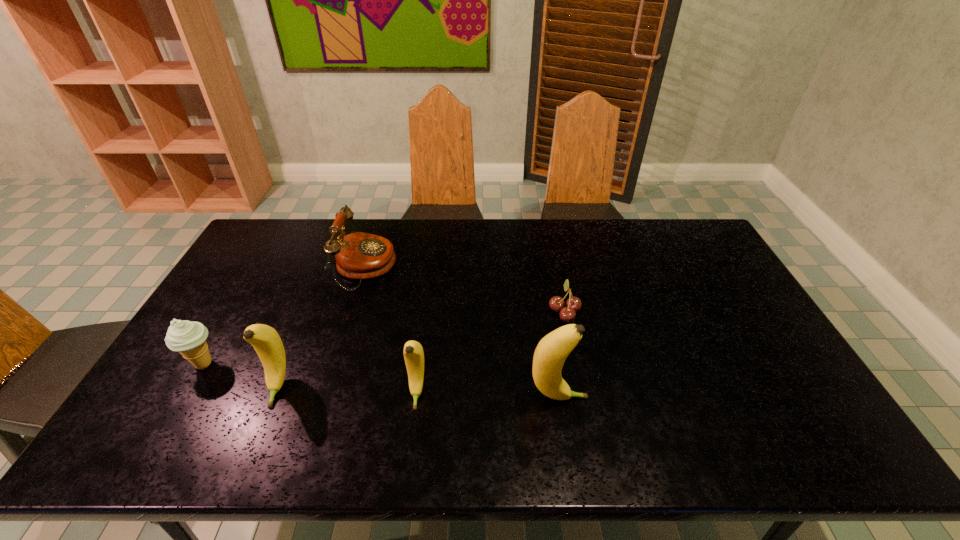
Image resolution: width=960 pixels, height=540 pixels. I want to click on free space located from the stem of the rightmost banana, so click(676, 398).

Where is `free space located on the dial of the third object from left to right`? Image resolution: width=960 pixels, height=540 pixels. free space located on the dial of the third object from left to right is located at coordinates (436, 267).

The width and height of the screenshot is (960, 540). I want to click on vacant area situated 0.350m on the right of the leftmost object, so click(x=351, y=364).

Locate an element on the screen. vacant area located 0.060m on the leaves of the shortest object is located at coordinates (529, 311).

Find the location of a particular element. This screenshot has width=960, height=540. blank space located on the leaves of the shortest object is located at coordinates (430, 311).

This screenshot has width=960, height=540. Find the location of `vacant space located on the leaves of the shortest object`. vacant space located on the leaves of the shortest object is located at coordinates (483, 311).

Identify the location of object at the far edge. The width and height of the screenshot is (960, 540). (359, 255).

Where is `object that is positioned at the left edge`? The height and width of the screenshot is (540, 960). object that is positioned at the left edge is located at coordinates (188, 338).

Find the location of a particular element. The image size is (960, 540). free space at the far edge of the desktop is located at coordinates (454, 252).

Image resolution: width=960 pixels, height=540 pixels. In the image, there is a desktop. Identify the location of free space at the near edge. (283, 398).